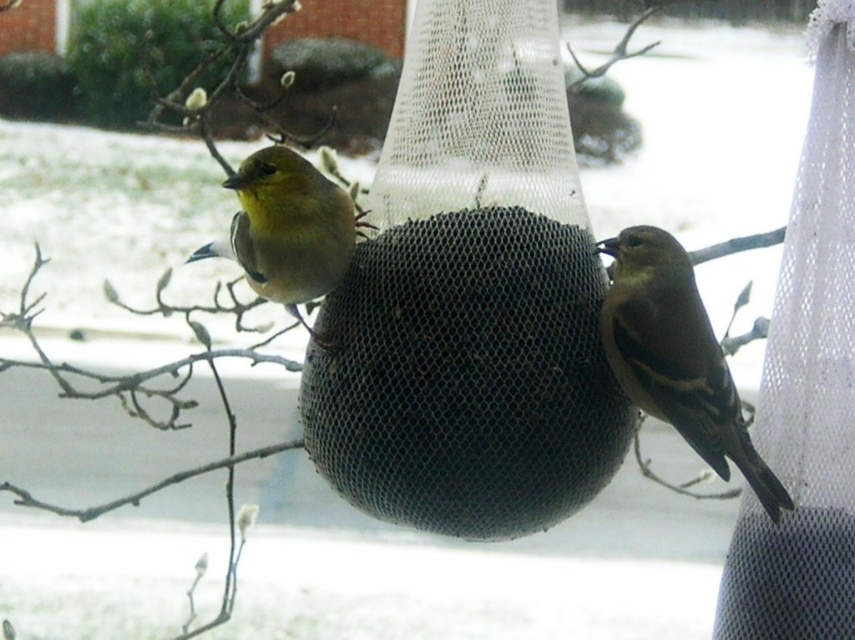
Does brown matte sparrow at center have a larger size compared to yellow matte bird at center?

Yes.

Between point (670, 365) and point (240, 250), which one is positioned in front?

Point (670, 365) is more forward.

Measure the distance between brown matte sparrow at center and camera.

brown matte sparrow at center is 6.36 feet from camera.

You are a GUI agent. You are given a task and a screenshot of the screen. Output one action in this format:
    pyautogui.click(x=<x>, y=<y>)
    Task: Click on the brown matte sparrow at center
    This screenshot has width=855, height=640.
    Given the screenshot: What is the action you would take?
    pyautogui.click(x=676, y=356)